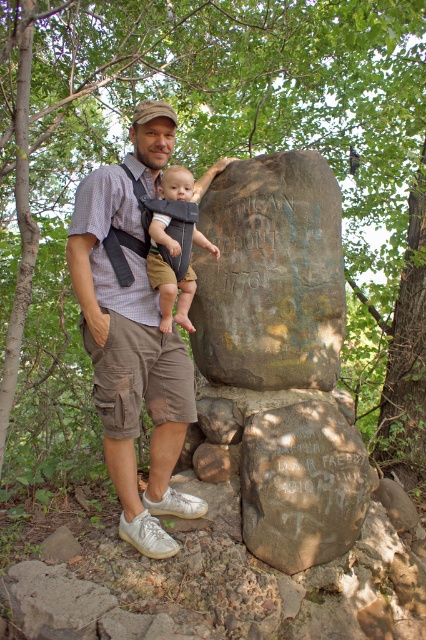
Can you confirm if rusty stone boulder at center is smaller than brown cotton shirt at center?

Actually, rusty stone boulder at center might be larger than brown cotton shirt at center.

Is rusty stone boulder at center thinner than brown cotton shirt at center?

No, rusty stone boulder at center is not thinner than brown cotton shirt at center.

Does point (255, 218) lie in front of point (146, 528)?

That is False.

The width and height of the screenshot is (426, 640). What are the coordinates of `rusty stone boulder at center` in the screenshot? It's located at (270, 275).

Between point (333, 374) and point (112, 268), which one is positioned in front?

Point (112, 268) is more forward.

Does brown rough stone at center appear under brown cotton shirt at center?

Yes.

Measure the distance between point (x=319, y=550) and camera.

They are 3.43 meters apart.

This screenshot has height=640, width=426. What are the coordinates of `brown rough stone at center` in the screenshot? It's located at (282, 353).

Who is positioned more to the right, brown cotton shirt at center or light brown fabric baby carrier at center?

From the viewer's perspective, light brown fabric baby carrier at center appears more on the right side.

Is brown cotton shirt at center further to the viewer compared to light brown fabric baby carrier at center?

No, it is in front of light brown fabric baby carrier at center.

The image size is (426, 640). In order to click on brown cotton shirt at center in this screenshot , I will do `click(131, 358)`.

The image size is (426, 640). Find the location of `brown cotton shirt at center`. brown cotton shirt at center is located at coordinates (131, 358).